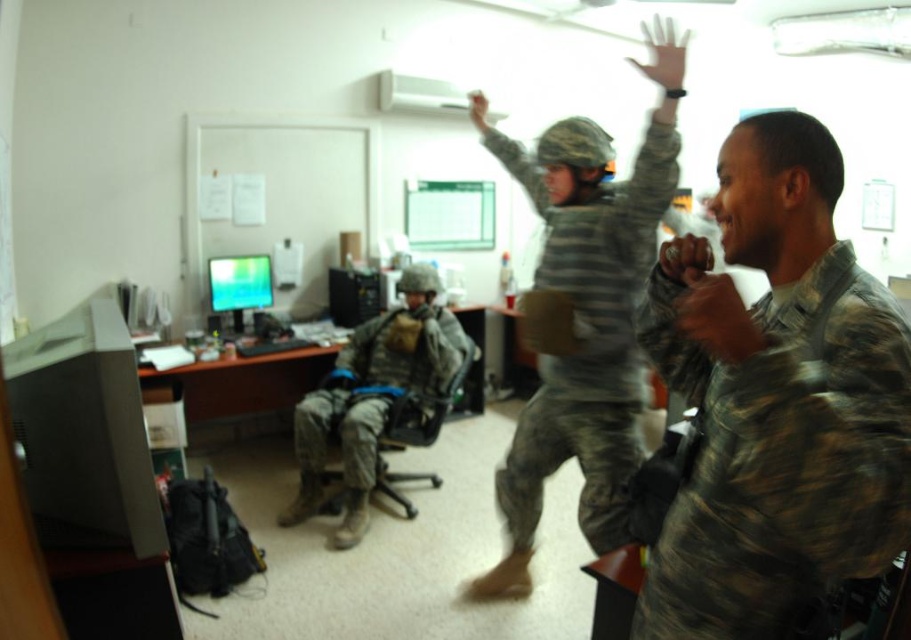
Question: Does camouflagetextured fabric at right lie behind camouflage fabric soldier at center?

Choices:
 (A) yes
 (B) no

Answer: (B)

Question: Which object is positioned farthest from the camouflagetextured fabric at right?

Choices:
 (A) camouflage uniform at center
 (B) camouflage fabric soldier at center

Answer: (A)

Question: Is camouflagetextured fabric at right to the right of camouflage uniform at center from the viewer's perspective?

Choices:
 (A) no
 (B) yes

Answer: (B)

Question: Which object appears closest to the camera in this image?

Choices:
 (A) camouflagetextured fabric at right
 (B) camouflage fabric soldier at center

Answer: (A)

Question: Observing the image, what is the correct spatial positioning of camouflage fabric soldier at center in reference to camouflage uniform at center?

Choices:
 (A) above
 (B) below

Answer: (A)

Question: Which of these objects is positioned farthest from the camouflagetextured fabric at right?

Choices:
 (A) camouflage fabric soldier at center
 (B) camouflage uniform at center

Answer: (B)